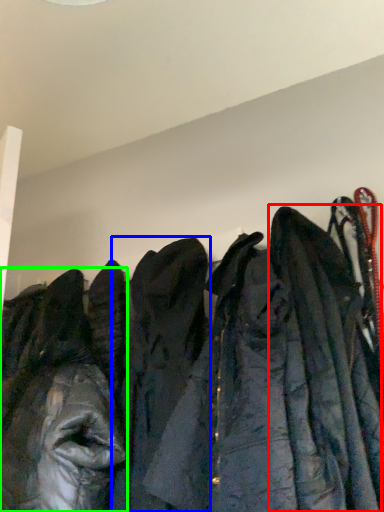
Question: Estimate the real-world distances between objects in this image. Which object is farther from cloak (highlighted by a red box), cloak (highlighted by a blue box) or jacket (highlighted by a green box)?

Choices:
 (A) cloak
 (B) jacket

Answer: (B)